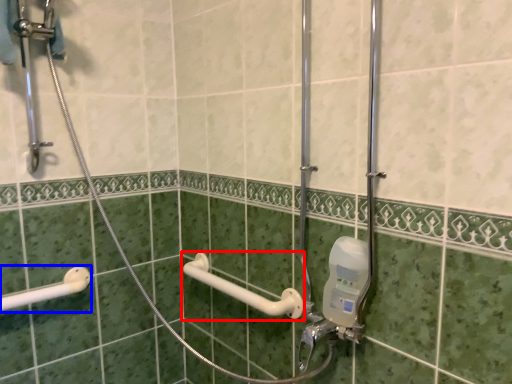
Question: Which object is closer to the camera taking this photo, towel bar (highlighted by a red box) or shower (highlighted by a blue box)?

Choices:
 (A) towel bar
 (B) shower

Answer: (A)